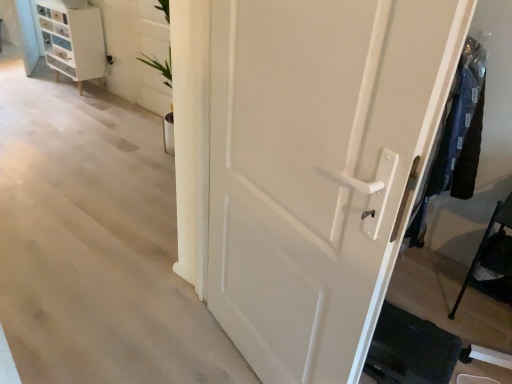
Identify the location of vacant space positioned to the left of black metal cane at lower right. Image resolution: width=512 pixels, height=384 pixels. (430, 297).